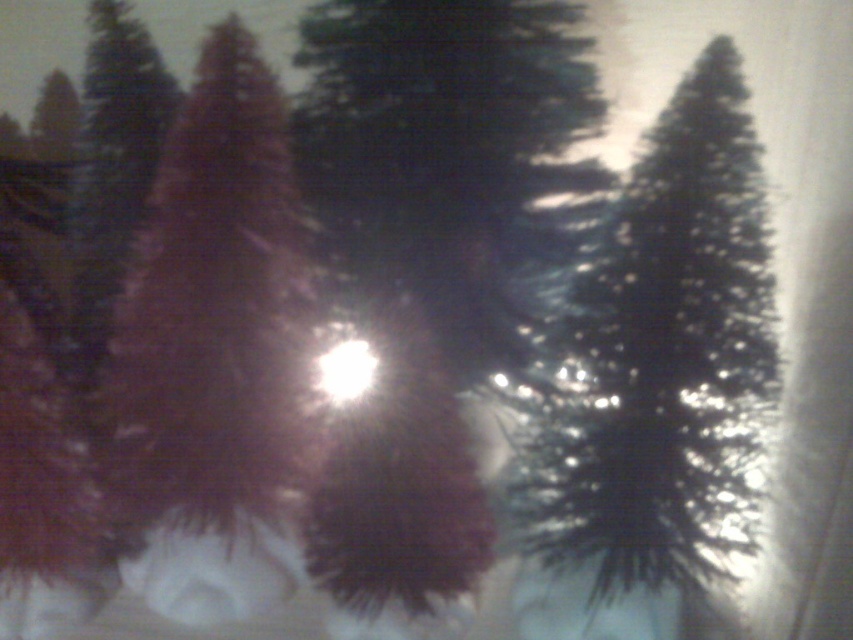
Question: Among these objects, which one is farthest from the camera?

Choices:
 (A) shiny red fir tree at left
 (B) matte red fir tree at center
 (C) shiny metallic fir tree at upper right
 (D) green matte tree at center

Answer: (B)

Question: Which of the following is the farthest from the observer?

Choices:
 (A) green matte tree at center
 (B) shiny metallic fir tree at upper right

Answer: (A)

Question: Which of the following is the farthest from the observer?

Choices:
 (A) shiny metallic fir tree at upper right
 (B) matte red fir tree at center
 (C) green matte tree at center

Answer: (B)

Question: Is the position of shiny metallic fir tree at upper right less distant than that of shiny red fir tree at left?

Choices:
 (A) yes
 (B) no

Answer: (A)

Question: Is green matte tree at center wider than shiny red fir tree at left?

Choices:
 (A) no
 (B) yes

Answer: (B)

Question: Observing the image, what is the correct spatial positioning of green matte tree at center in reference to matte red fir tree at center?

Choices:
 (A) left
 (B) right

Answer: (B)